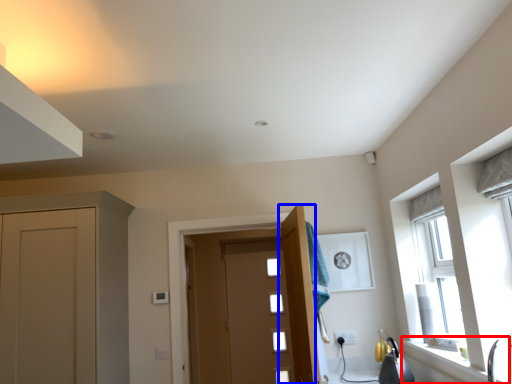
Question: Among these objects, which one is farthest to the camera, window sill (highlighted by a red box) or door (highlighted by a blue box)?

Choices:
 (A) window sill
 (B) door

Answer: (B)